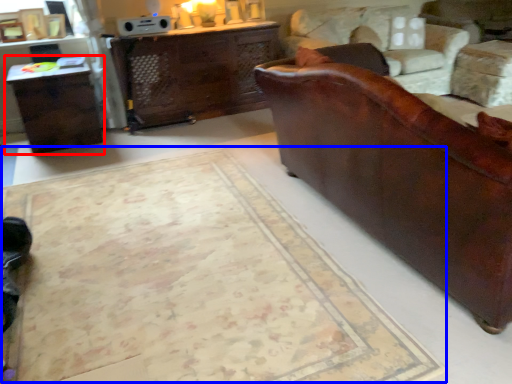
Question: Which object is further to the camera taking this photo, table (highlighted by a red box) or mat (highlighted by a blue box)?

Choices:
 (A) table
 (B) mat

Answer: (A)